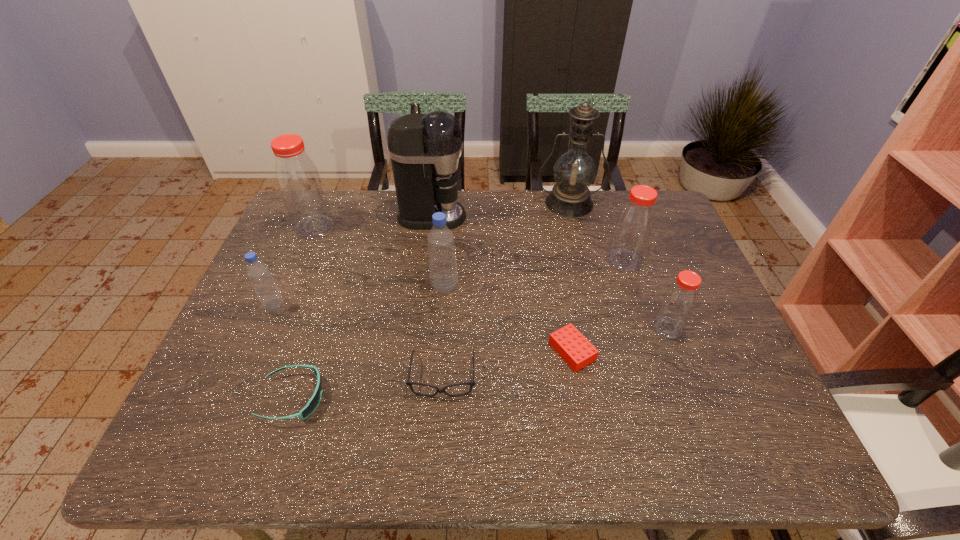
Identify which bottle is located as the third nearest to the farthest red bottle. Please provide its 2D coordinates. Your answer should be formatted as a tuple, i.e. [(x, y)], where the tuple contains the x and y coordinates of a point satisfying the conditions above.

[(634, 224)]

This screenshot has height=540, width=960. Identify the location of red bottle that can be found as the second closest to the farthest bottle. (x=679, y=301).

Select which red bottle is the third closest to the sunglasses. Please provide its 2D coordinates. Your answer should be formatted as a tuple, i.e. [(x, y)], where the tuple contains the x and y coordinates of a point satisfying the conditions above.

[(634, 224)]

This screenshot has height=540, width=960. What are the coordinates of `vacant point that satisfies the following two spatial constraints: 1. place cup under the spout of the coffee maker; 2. on the back side of the shortest object` in the screenshot? It's located at (415, 351).